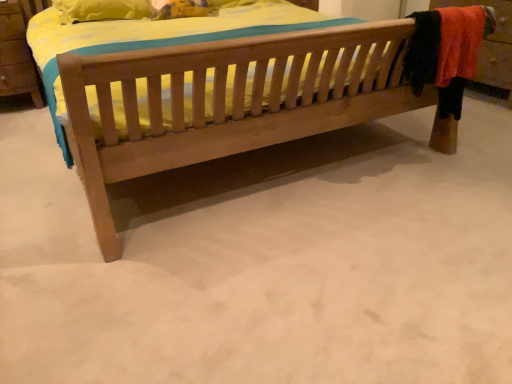
Question: From a real-world perspective, is natural wood bed at center above or below wooden dresser at right?

Choices:
 (A) below
 (B) above

Answer: (A)

Question: Looking at the image, does natural wood bed at center seem bigger or smaller compared to wooden dresser at right?

Choices:
 (A) small
 (B) big

Answer: (B)

Question: Is point (375, 97) positioned closer to the camera than point (480, 62)?

Choices:
 (A) closer
 (B) farther

Answer: (A)

Question: From the image's perspective, is wooden dresser at right above or below natural wood bed at center?

Choices:
 (A) above
 (B) below

Answer: (A)

Question: In terms of height, does wooden dresser at right look taller or shorter compared to natural wood bed at center?

Choices:
 (A) tall
 (B) short

Answer: (A)

Question: From a real-world perspective, is wooden dresser at right physically located above or below natural wood bed at center?

Choices:
 (A) above
 (B) below

Answer: (A)

Question: Considering their positions, is wooden dresser at right located in front of or behind natural wood bed at center?

Choices:
 (A) behind
 (B) front

Answer: (A)